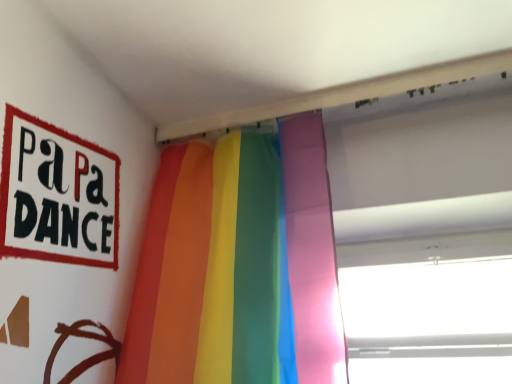
Question: Is rainbow fabric curtain at center with transparent plastic window at upper right?

Choices:
 (A) no
 (B) yes

Answer: (A)

Question: From the image's perspective, does rainbow fabric curtain at center appear lower than transparent plastic window at upper right?

Choices:
 (A) no
 (B) yes

Answer: (A)

Question: Can you confirm if rainbow fabric curtain at center is smaller than transparent plastic window at upper right?

Choices:
 (A) yes
 (B) no

Answer: (A)

Question: Could transparent plastic window at upper right be considered to be inside rainbow fabric curtain at center?

Choices:
 (A) yes
 (B) no

Answer: (B)

Question: Considering the relative positions of rainbow fabric curtain at center and transparent plastic window at upper right in the image provided, is rainbow fabric curtain at center to the left of transparent plastic window at upper right from the viewer's perspective?

Choices:
 (A) yes
 (B) no

Answer: (A)

Question: Is rainbow fabric curtain at center wider than transparent plastic window at upper right?

Choices:
 (A) no
 (B) yes

Answer: (A)

Question: Is rainbow fabric curtain at center completely or partially inside transparent plastic window at upper right?

Choices:
 (A) yes
 (B) no

Answer: (B)

Question: Is transparent plastic window at upper right not near rainbow fabric curtain at center?

Choices:
 (A) yes
 (B) no

Answer: (B)

Question: Is transparent plastic window at upper right outside rainbow fabric curtain at center?

Choices:
 (A) no
 (B) yes

Answer: (B)

Question: Is transparent plastic window at upper right facing towards rainbow fabric curtain at center?

Choices:
 (A) no
 (B) yes

Answer: (A)

Question: From a real-world perspective, is transparent plastic window at upper right located beneath rainbow fabric curtain at center?

Choices:
 (A) yes
 (B) no

Answer: (A)

Question: Is transparent plastic window at upper right smaller than rainbow fabric curtain at center?

Choices:
 (A) no
 (B) yes

Answer: (A)

Question: Is rainbow fabric curtain at center wider or thinner than transparent plastic window at upper right?

Choices:
 (A) wide
 (B) thin

Answer: (B)